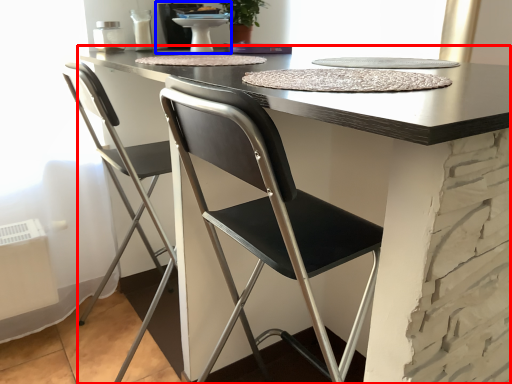
Question: Which object appears closest to the camera in this image, table (highlighted by a red box) or sink (highlighted by a blue box)?

Choices:
 (A) table
 (B) sink

Answer: (A)